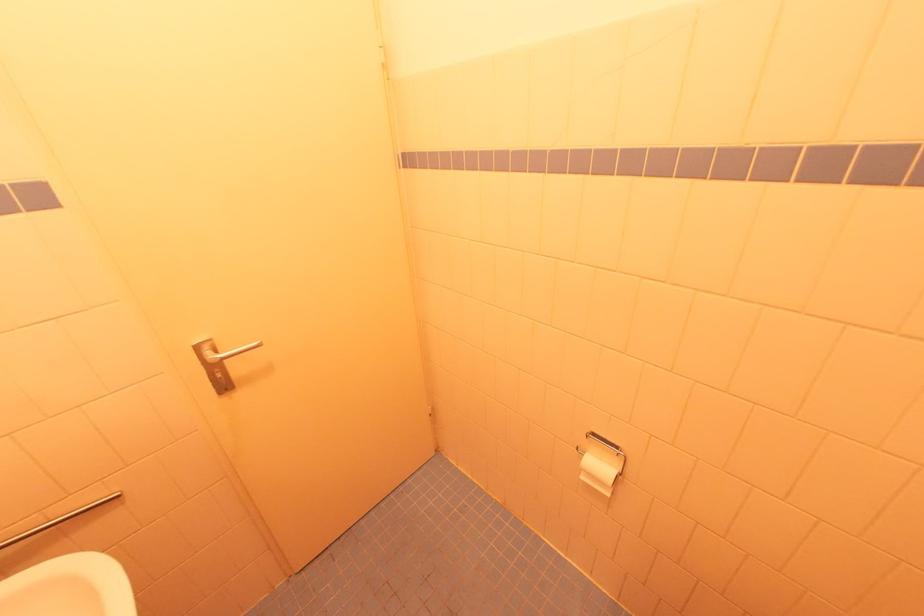
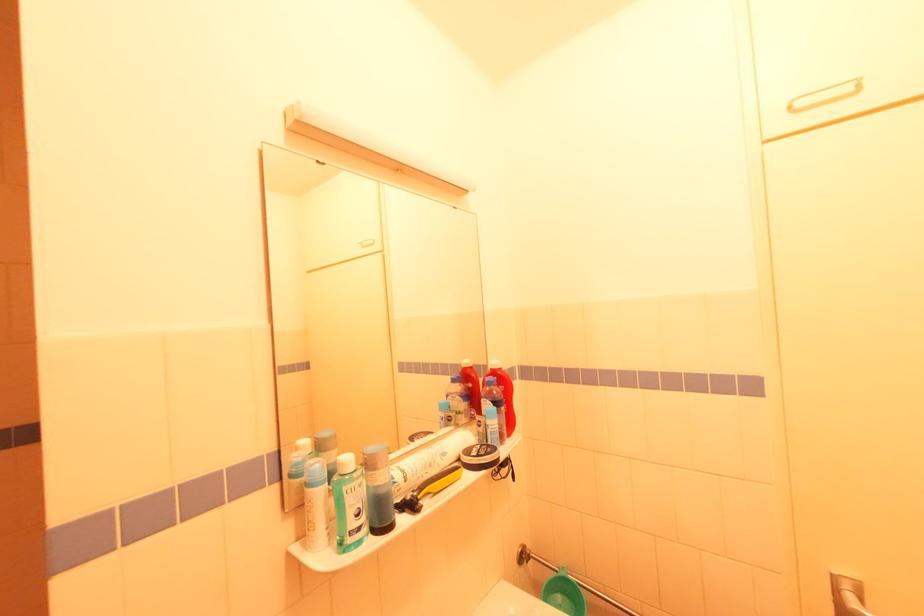
Question: The images are taken continuously from a first-person perspective. In which direction is your viewpoint rotating?

Choices:
 (A) Left
 (B) Right
 (C) Up
 (D) Down

Answer: (A)